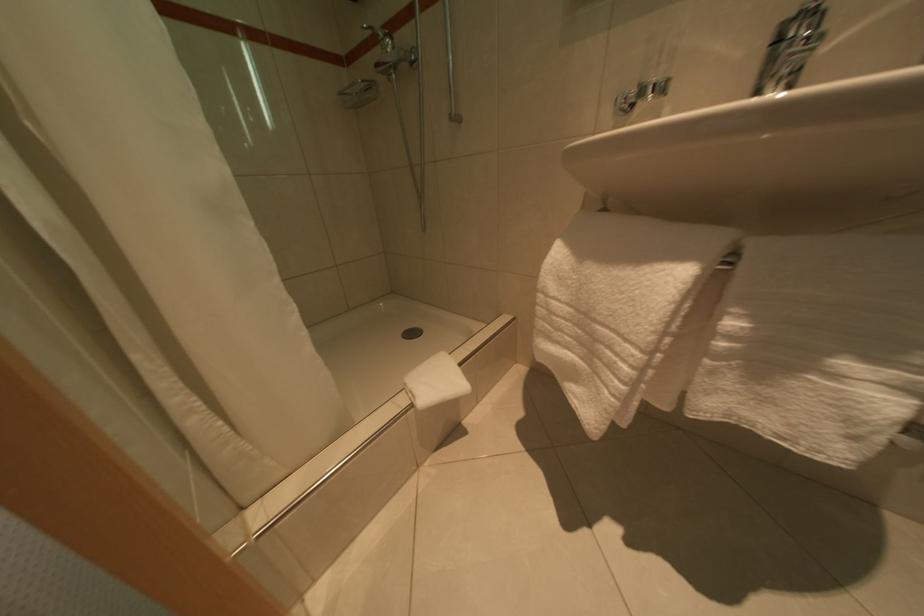
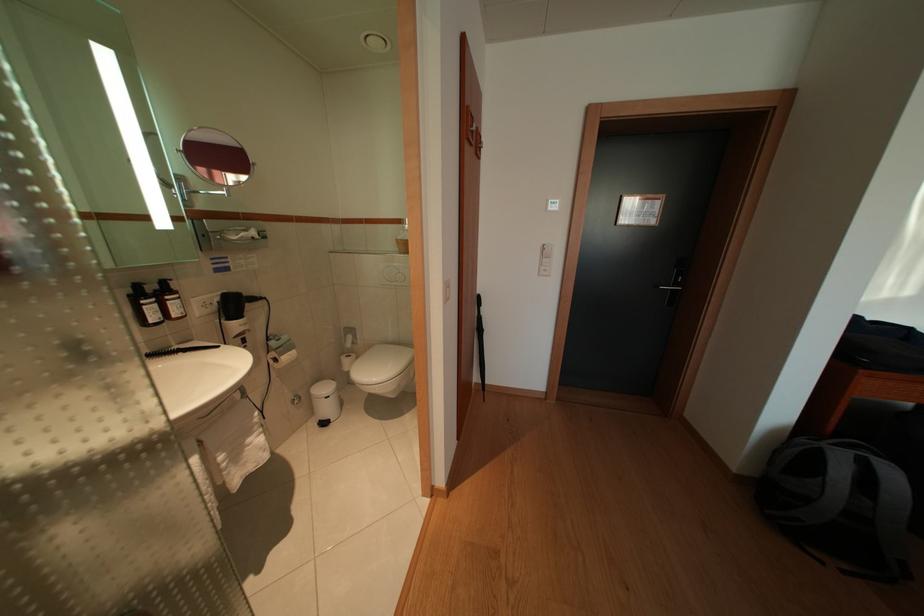
First-person continuous shooting, in which direction is the camera rotating?

The camera's rotation is toward right-down.